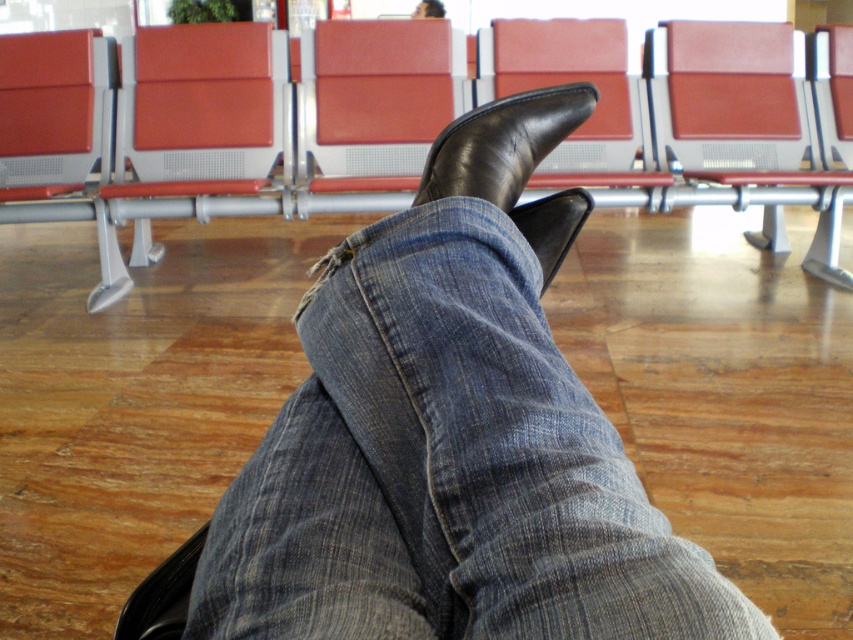
Is leather seat at center thinner than black leather shoe at center?

In fact, leather seat at center might be wider than black leather shoe at center.

The image size is (853, 640). What do you see at coordinates (373, 104) in the screenshot?
I see `leather seat at center` at bounding box center [373, 104].

Where is `leather seat at center`? This screenshot has width=853, height=640. leather seat at center is located at coordinates (373, 104).

Which is more to the right, shiny black boot at center or black leather shoe at center?

From the viewer's perspective, black leather shoe at center appears more on the right side.

Who is more forward, (x=448, y=164) or (x=566, y=196)?

Point (x=448, y=164) is in front.

Who is more distant from viewer, (490, 140) or (543, 291)?

The point (490, 140) is more distant.

Locate an element on the screen. Image resolution: width=853 pixels, height=640 pixels. shiny black boot at center is located at coordinates (502, 144).

Who is lower down, denim at center or matte leather chair at center?

Positioned lower is denim at center.

Who is positioned more to the right, denim at center or matte leather chair at center?

Positioned to the right is matte leather chair at center.

Is point (511, 227) positioned before point (634, 179)?

Yes.

I want to click on denim at center, so click(445, 467).